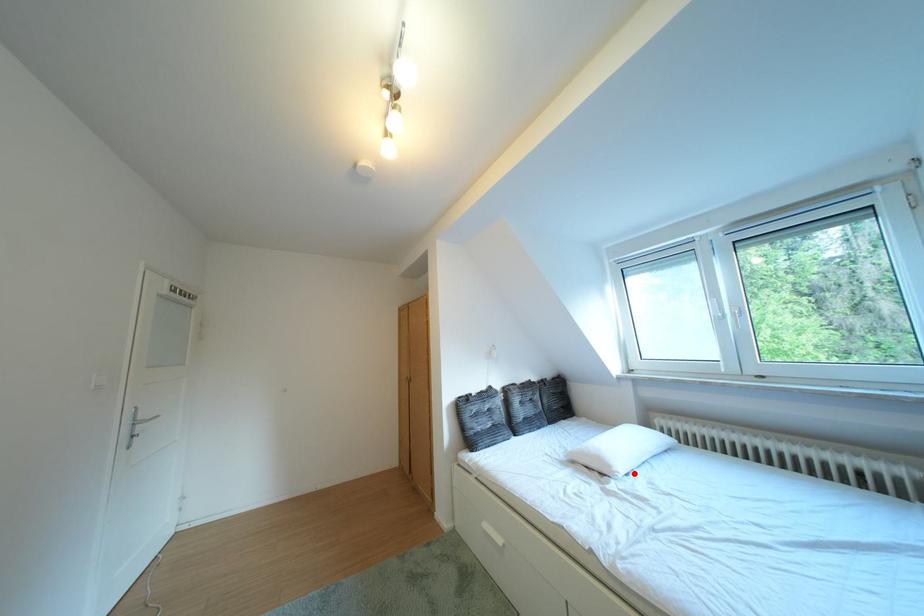
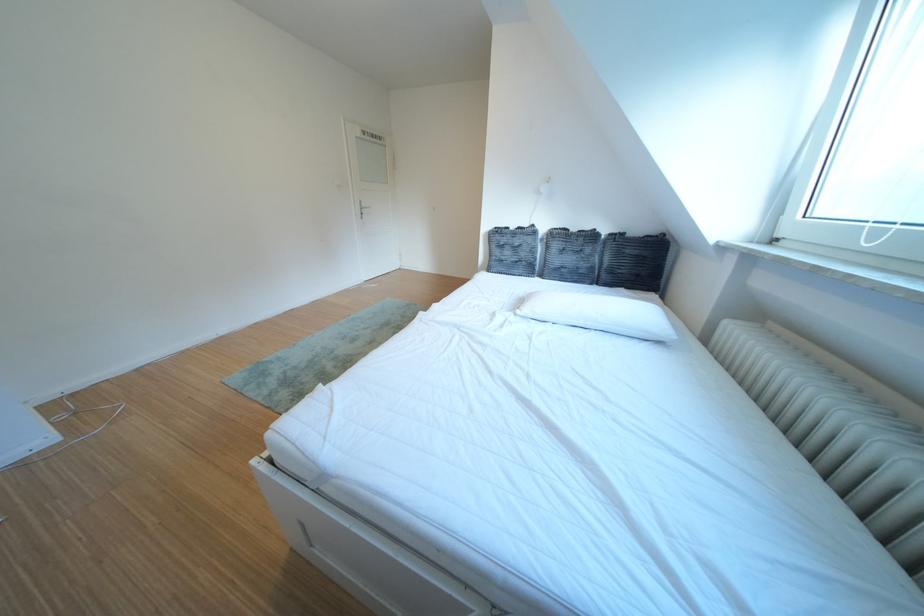
Question: I am providing you with two images of the same scene from different viewpoints. A red point is marked on the first image. Is the red point's position out of view in image 2?

Choices:
 (A) Yes
 (B) No

Answer: (B)